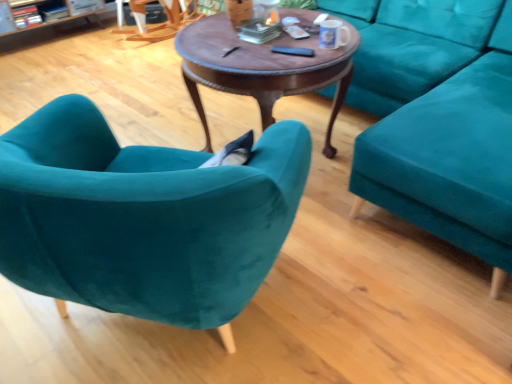
Image resolution: width=512 pixels, height=384 pixels. In order to click on vacant area that is situated to the right of white plastic remote control at center, arranged as the first remote control when viewed from the back in this screenshot , I will do `click(329, 36)`.